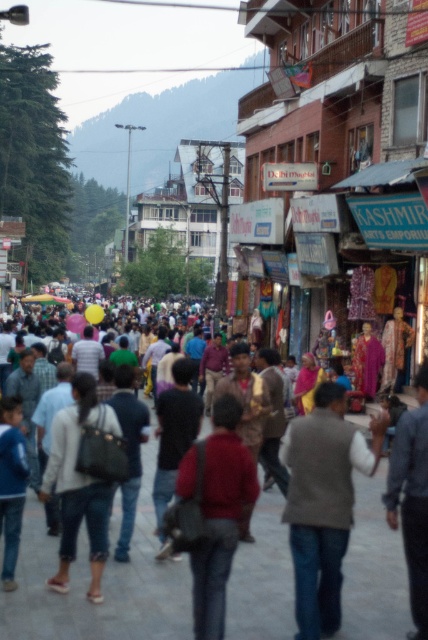
Is multicolored clothing at center closer to camera compared to brown woolen vest at center?

No, multicolored clothing at center is behind brown woolen vest at center.

Does point (376, 515) lie in front of point (356, 435)?

No.

Is point (5, 609) more distant than point (332, 403)?

Yes, it is.

Locate an element on the screen. multicolored clothing at center is located at coordinates (103, 580).